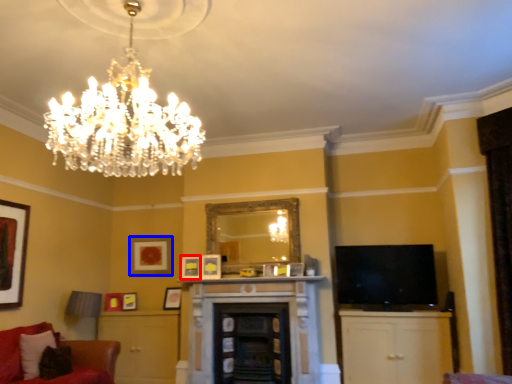
Question: Which object is further to the camera taking this photo, picture frame (highlighted by a red box) or picture frame (highlighted by a blue box)?

Choices:
 (A) picture frame
 (B) picture frame

Answer: (B)